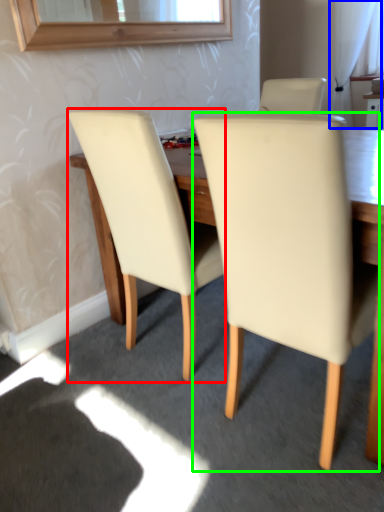
Question: Which is farther away from chair (highlighted by a red box)? curtain (highlighted by a blue box) or chair (highlighted by a green box)?

Choices:
 (A) curtain
 (B) chair

Answer: (A)